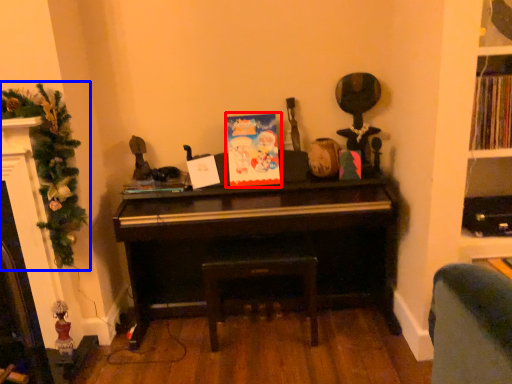
Question: Among these objects, which one is nearest to the camera, christmas card (highlighted by a red box) or christmas tree (highlighted by a blue box)?

Choices:
 (A) christmas card
 (B) christmas tree

Answer: (B)